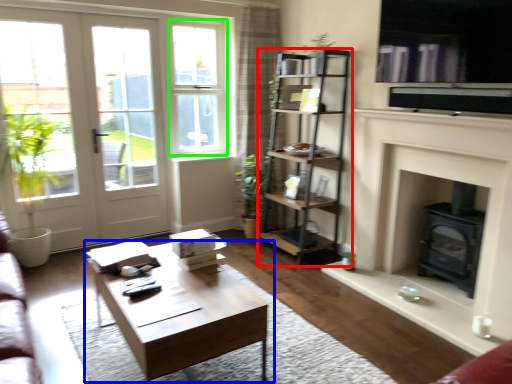
Question: Which is farther away from shelf (highlighted by a red box)? coffee table (highlighted by a blue box) or window frame (highlighted by a green box)?

Choices:
 (A) coffee table
 (B) window frame

Answer: (A)